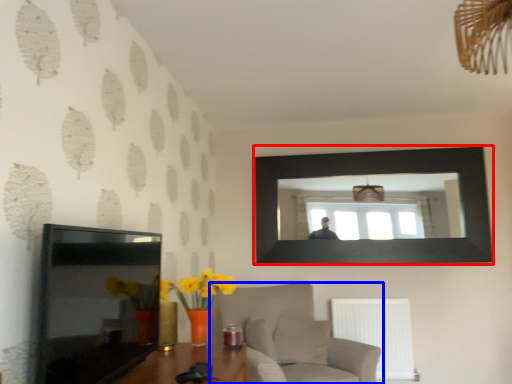
Question: Which of the following is the farthest to the observer, picture frame (highlighted by a red box) or furniture (highlighted by a blue box)?

Choices:
 (A) picture frame
 (B) furniture

Answer: (A)